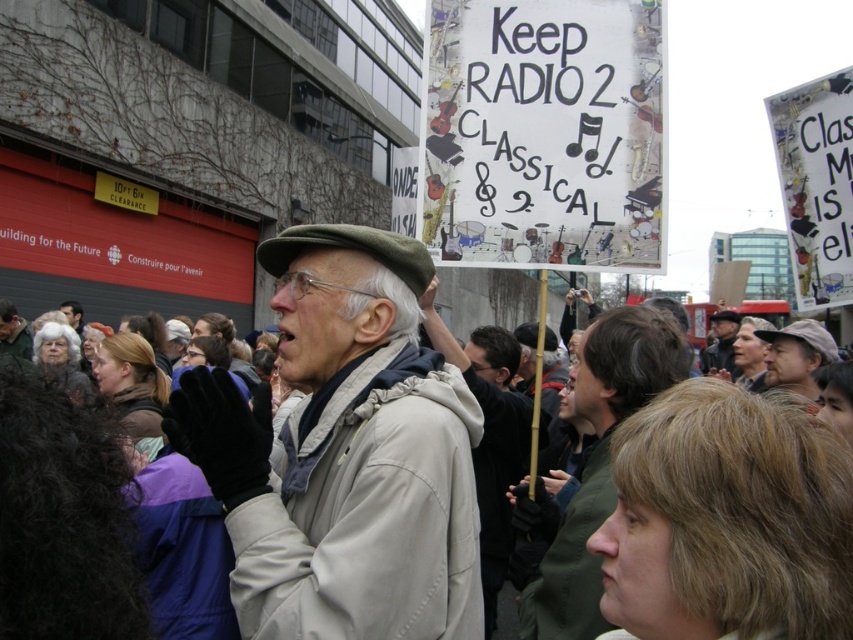
Does dark brown leather jacket at center have a smaller size compared to light brown leather jacket at center?

No, dark brown leather jacket at center is not smaller than light brown leather jacket at center.

From the picture: Is dark brown leather jacket at center closer to camera compared to light brown leather jacket at center?

Yes, it is in front of light brown leather jacket at center.

In order to click on dark brown leather jacket at center in this screenshot , I will do `click(590, 468)`.

Locate an element on the screen. The image size is (853, 640). dark brown leather jacket at center is located at coordinates (590, 468).

Between point (357, 452) and point (601, 344), which one is positioned behind?

Positioned behind is point (601, 344).

Can you confirm if light beige jacket at center is taller than dark brown leather jacket at center?

No.

Who is more forward, (315,540) or (595,333)?

Point (315,540) is in front.

This screenshot has width=853, height=640. I want to click on light beige jacket at center, so click(x=344, y=452).

Can you confirm if dark brown leather jacket at center is positioned above brown leather cap at upper right?

No, dark brown leather jacket at center is not above brown leather cap at upper right.

Who is positioned more to the right, dark brown leather jacket at center or brown leather cap at upper right?

brown leather cap at upper right is more to the right.

Does point (654, 394) lie behind point (778, 353)?

That is False.

Find the location of a particular element. The image size is (853, 640). dark brown leather jacket at center is located at coordinates (590, 468).